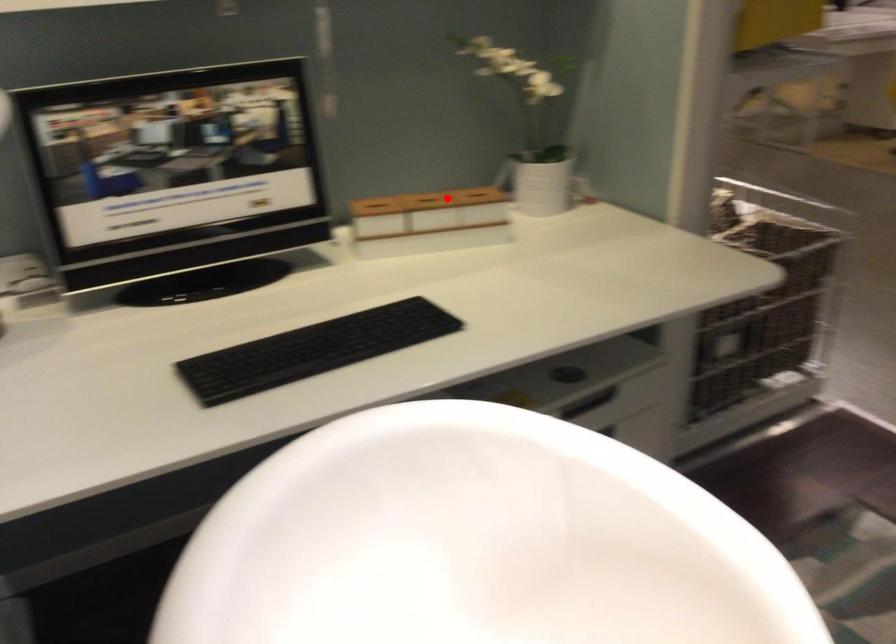
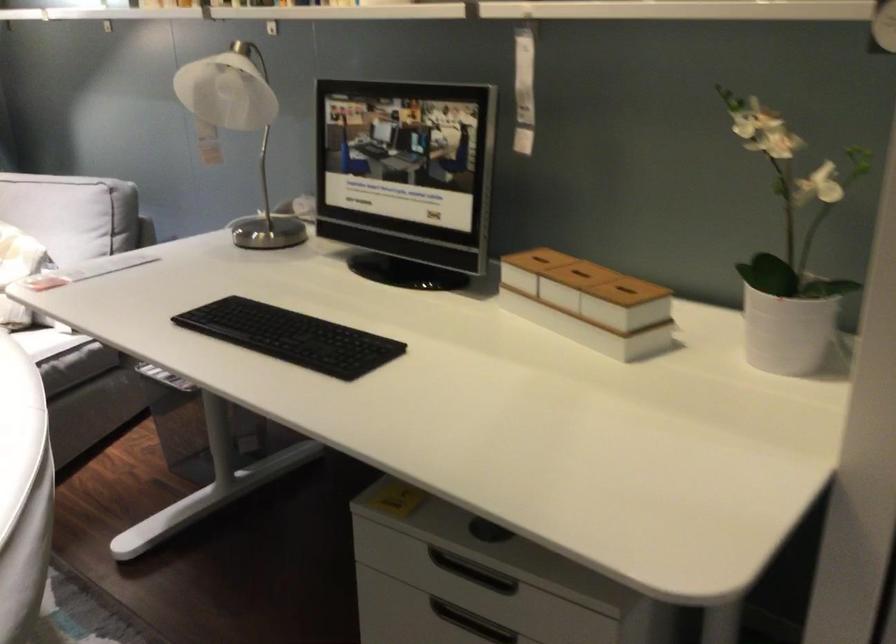
Question: A red point is marked in image1. In image2, is the corresponding 3D point closer to the camera or farther? Reply with the corresponding letter.

Choices:
 (A) The corresponding 3D point is closer.
 (B) The corresponding 3D point is farther.

Answer: (A)